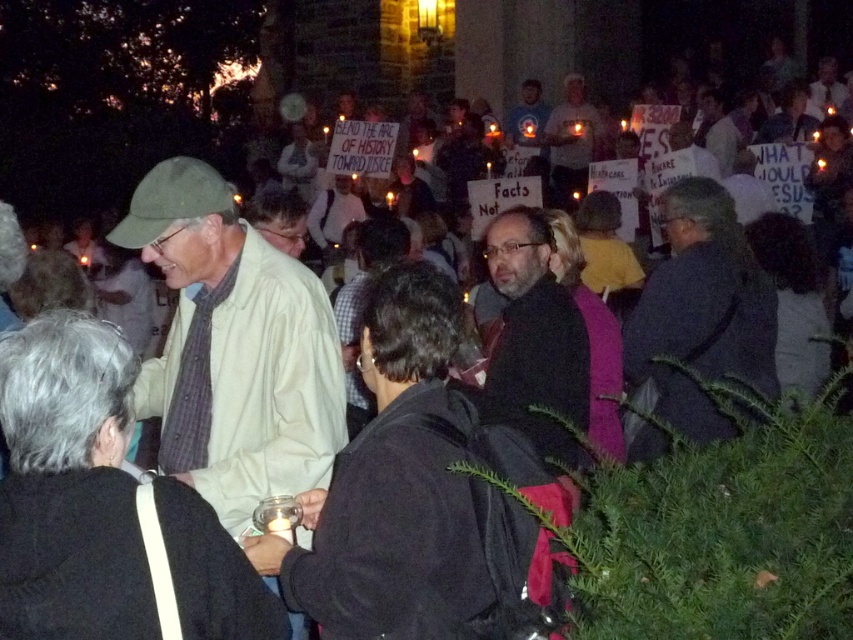
Is light beige shirt at center positioned at the back of dark gray jacket at center?

No, light beige shirt at center is in front of dark gray jacket at center.

In the scene shown: Can you confirm if light beige shirt at center is wider than dark gray jacket at center?

Correct, the width of light beige shirt at center exceeds that of dark gray jacket at center.

Identify the location of light beige shirt at center. Image resolution: width=853 pixels, height=640 pixels. (233, 348).

Can you confirm if light beige shirt at center is smaller than white shirt at center?

Actually, light beige shirt at center might be larger than white shirt at center.

Which is below, light beige shirt at center or white shirt at center?

Positioned lower is light beige shirt at center.

Does point (210, 237) come farther from viewer compared to point (561, 100)?

No.

Where is `light beige shirt at center`? The image size is (853, 640). light beige shirt at center is located at coordinates (233, 348).

Which is behind, point (196, 324) or point (543, 381)?

The point (543, 381) is more distant.

Describe the element at coordinates (233, 348) in the screenshot. The image size is (853, 640). I see `light beige shirt at center` at that location.

Does point (260, 369) come in front of point (582, 404)?

Yes, it is.

The height and width of the screenshot is (640, 853). I want to click on light beige shirt at center, so click(x=233, y=348).